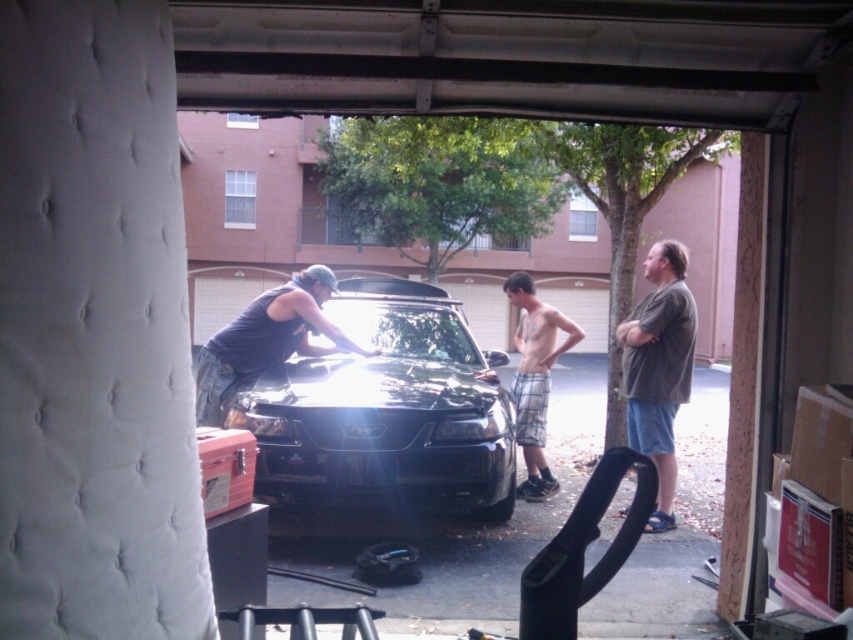
Who is lower down, dark gray t-shirt at right or plaid shorts at center?

dark gray t-shirt at right

Does point (660, 433) come closer to viewer compared to point (532, 422)?

Yes, point (660, 433) is in front of point (532, 422).

At what (x,y) coordinates should I click in order to perform the action: click on dark gray t-shirt at right. Please return your answer as a coordinate pair (x, y). This screenshot has height=640, width=853. Looking at the image, I should click on (659, 368).

Is black glossy car at center above dark gray tank top at center?

No, black glossy car at center is not above dark gray tank top at center.

Between black glossy car at center and dark gray tank top at center, which one is positioned lower?

black glossy car at center

The image size is (853, 640). Describe the element at coordinates (386, 410) in the screenshot. I see `black glossy car at center` at that location.

Where is `black glossy car at center`? Image resolution: width=853 pixels, height=640 pixels. black glossy car at center is located at coordinates (386, 410).

Between black glossy car at center and plaid shorts at center, which one is positioned lower?

black glossy car at center is below.

Can you confirm if black glossy car at center is positioned below plaid shorts at center?

Yes, black glossy car at center is below plaid shorts at center.

Who is more distant from viewer, (396, 452) or (527, 275)?

Point (527, 275)

Find the location of a particular element. The width and height of the screenshot is (853, 640). black glossy car at center is located at coordinates (386, 410).